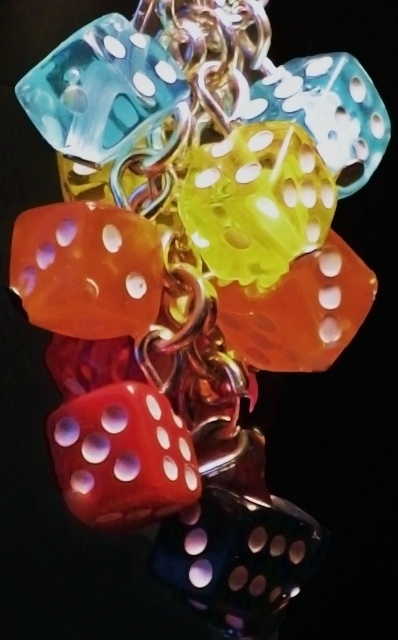
Between point (228, 268) and point (76, 52), which one is positioned in front?

Point (76, 52) is in front.

Is translucent yellow dice at center smaller than translucent blue dice at upper left?

Incorrect, translucent yellow dice at center is not smaller in size than translucent blue dice at upper left.

What do you see at coordinates (255, 202) in the screenshot? The image size is (398, 640). I see `translucent yellow dice at center` at bounding box center [255, 202].

The width and height of the screenshot is (398, 640). I want to click on translucent yellow dice at center, so click(255, 202).